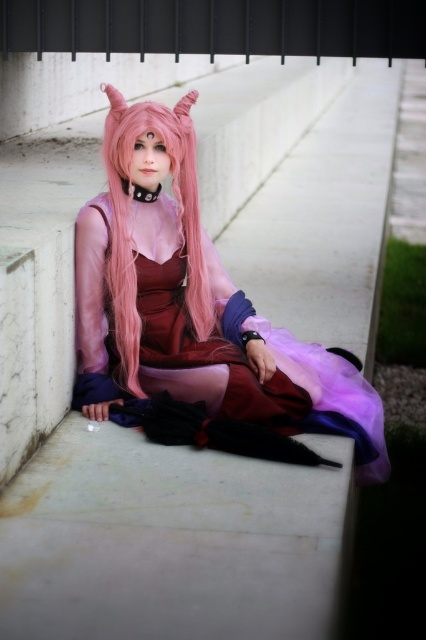
From the picture: Does satin pink dress at center have a larger size compared to pink silky hair at center?

Correct, satin pink dress at center is larger in size than pink silky hair at center.

At what (x,y) coordinates should I click in order to perform the action: click on satin pink dress at center. Please return your answer as a coordinate pair (x, y). This screenshot has width=426, height=640. Looking at the image, I should click on (192, 305).